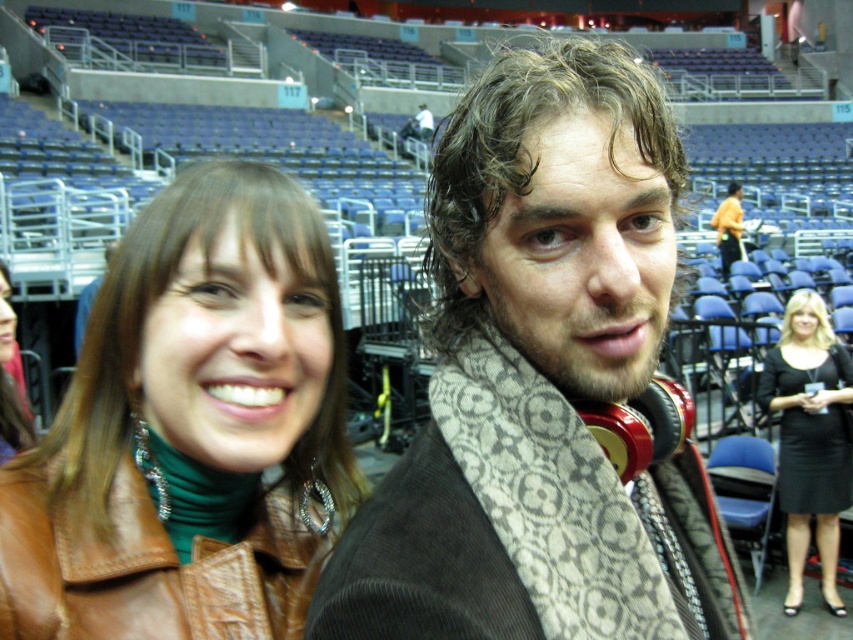
Which is below, brown leather jacket at center or beige patterned scarf at center?

beige patterned scarf at center is lower down.

Is brown leather jacket at center below beige patterned scarf at center?

Actually, brown leather jacket at center is above beige patterned scarf at center.

Identify the location of brown leather jacket at center. (190, 428).

Between patterned scarf at center and black satin dress at lower right, which one appears on the left side from the viewer's perspective?

patterned scarf at center is more to the left.

The width and height of the screenshot is (853, 640). Describe the element at coordinates (541, 384) in the screenshot. I see `patterned scarf at center` at that location.

Image resolution: width=853 pixels, height=640 pixels. I want to click on patterned scarf at center, so click(541, 384).

Measure the distance between point (x=543, y=332) and camera.

A distance of 32.61 inches exists between point (x=543, y=332) and camera.

Which is behind, point (573, 460) or point (134, 472)?

Positioned behind is point (134, 472).

Does point (469, 173) come in front of point (181, 426)?

Yes, point (469, 173) is closer to viewer.

Locate an element on the screen. patterned scarf at center is located at coordinates (541, 384).